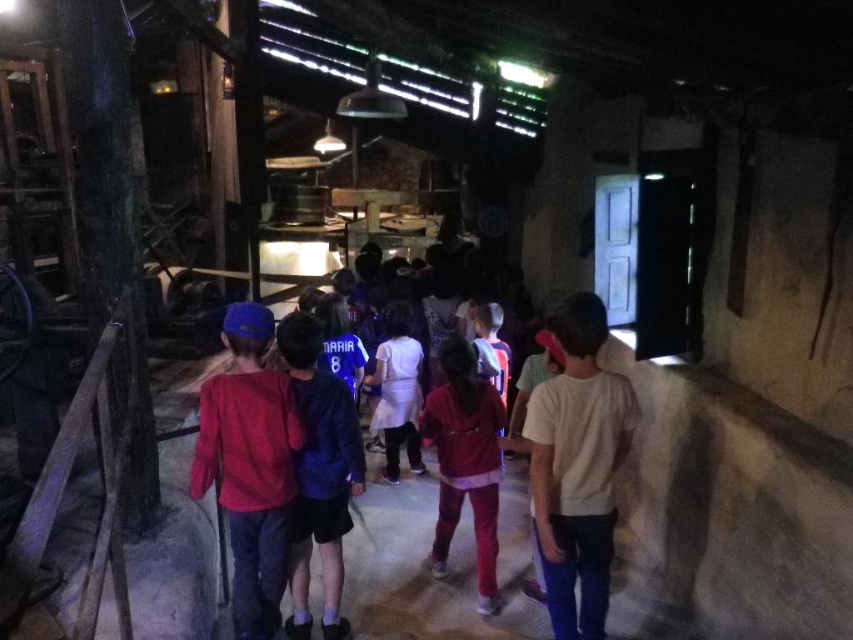
Which of these two, velvet red jacket at center or white cotton dress at center, stands shorter?

white cotton dress at center

Image resolution: width=853 pixels, height=640 pixels. What do you see at coordinates (465, 461) in the screenshot?
I see `velvet red jacket at center` at bounding box center [465, 461].

Where is `velvet red jacket at center`? velvet red jacket at center is located at coordinates (465, 461).

Can you confirm if blue jersey at center is positioned below velvet red jacket at center?

Incorrect, blue jersey at center is not positioned below velvet red jacket at center.

Who is positioned more to the right, blue jersey at center or velvet red jacket at center?

From the viewer's perspective, velvet red jacket at center appears more on the right side.

Image resolution: width=853 pixels, height=640 pixels. What do you see at coordinates (318, 474) in the screenshot?
I see `blue jersey at center` at bounding box center [318, 474].

Where is `blue jersey at center`? This screenshot has width=853, height=640. blue jersey at center is located at coordinates (318, 474).

Is matte red shirt at center positioned at the back of white cotton dress at center?

No, it is not.

Locate an element on the screen. This screenshot has height=640, width=853. matte red shirt at center is located at coordinates (250, 465).

Does point (283, 588) lie behind point (384, 428)?

No, it is in front of (384, 428).

I want to click on matte red shirt at center, so click(250, 465).